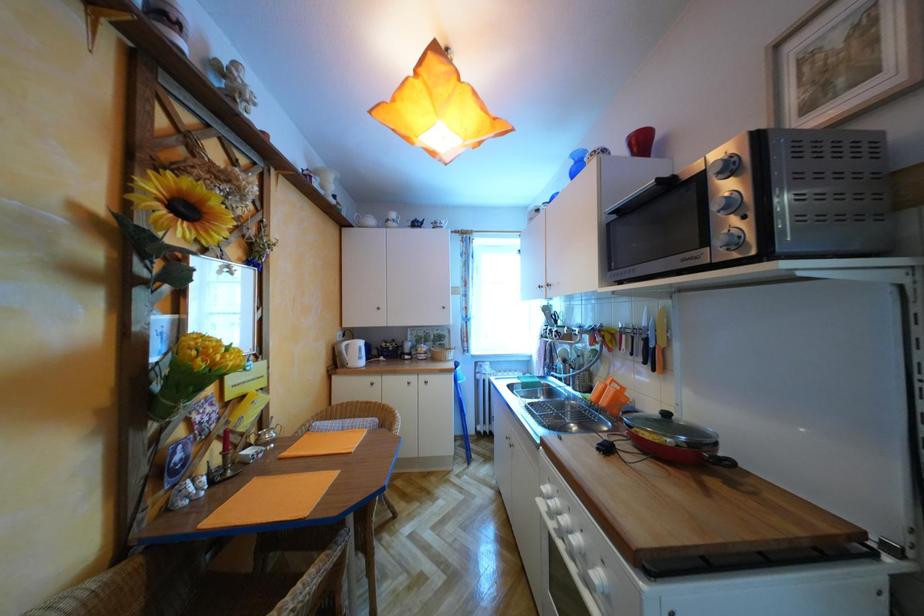
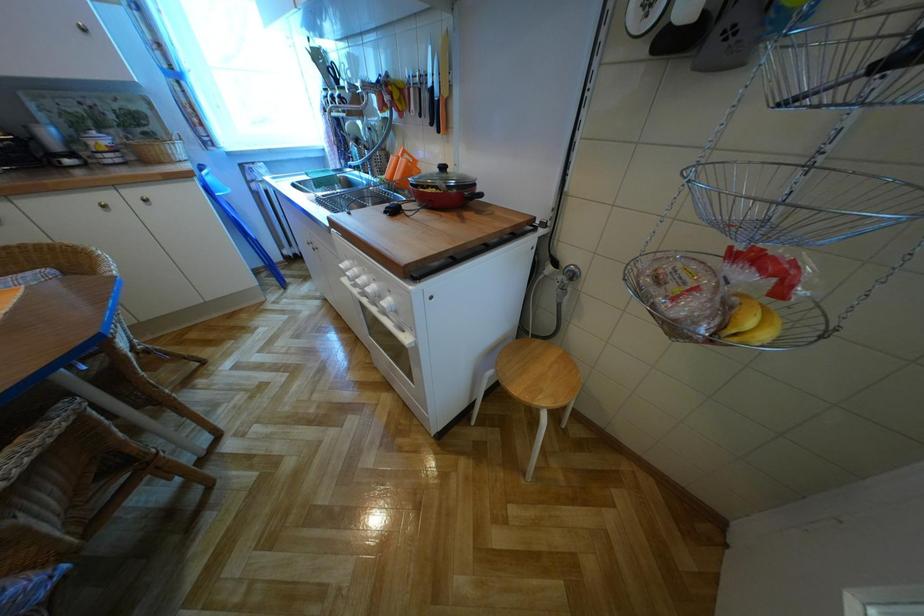
Based on the continuous images, in which direction is the camera rotating?

The rotation direction of the camera is right-down.